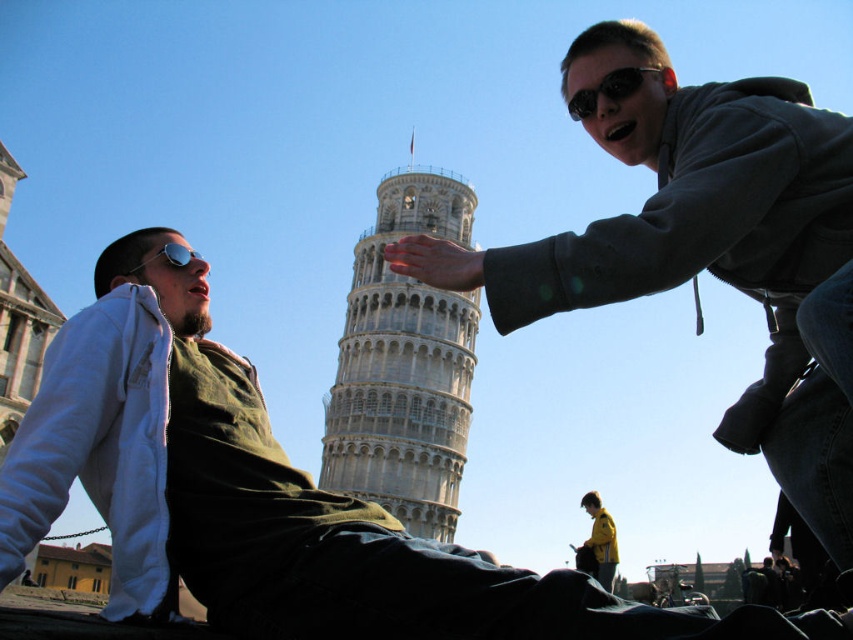
Question: Is matte black jacket at center below sunglasses at center?

Choices:
 (A) yes
 (B) no

Answer: (A)

Question: Is dark gray hoodie at upper right smaller than silver reflective sunglasses at upper left?

Choices:
 (A) yes
 (B) no

Answer: (B)

Question: Estimate the real-world distances between objects in this image. Which object is closer to the matte black jacket at center?

Choices:
 (A) dark gray hoodie at upper right
 (B) silver reflective sunglasses at upper left

Answer: (B)

Question: Considering the real-world distances, which object is farthest from the matte black jacket at center?

Choices:
 (A) dark gray hoodie at upper right
 (B) sunglasses at center
 (C) white stone tower at center
 (D) silver reflective sunglasses at upper left

Answer: (C)

Question: Considering the real-world distances, which object is closest to the white stone tower at center?

Choices:
 (A) matte black jacket at center
 (B) sunglasses at center
 (C) silver reflective sunglasses at upper left

Answer: (A)

Question: Can you confirm if matte black jacket at center is wider than white stone tower at center?

Choices:
 (A) no
 (B) yes

Answer: (B)